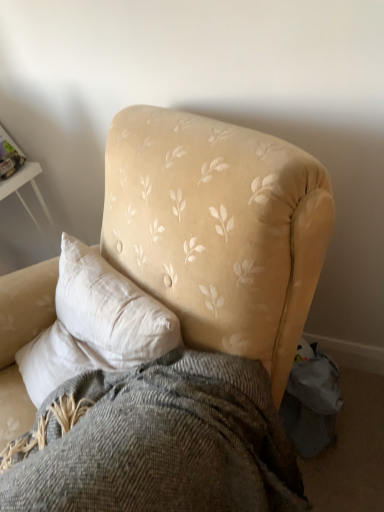
Question: Is textured gray blanket at center inside the boundaries of velvet yellow armchair at center, or outside?

Choices:
 (A) inside
 (B) outside

Answer: (A)

Question: Is textured gray blanket at center to the left or to the right of velvet yellow armchair at center in the image?

Choices:
 (A) right
 (B) left

Answer: (A)

Question: Looking at their shapes, would you say textured gray blanket at center is wider or thinner than velvet yellow armchair at center?

Choices:
 (A) wide
 (B) thin

Answer: (B)

Question: Is velvet yellow armchair at center taller or shorter than textured gray blanket at center?

Choices:
 (A) tall
 (B) short

Answer: (A)

Question: In terms of size, does velvet yellow armchair at center appear bigger or smaller than textured gray blanket at center?

Choices:
 (A) small
 (B) big

Answer: (B)

Question: Considering their positions, is velvet yellow armchair at center located in front of or behind textured gray blanket at center?

Choices:
 (A) behind
 (B) front

Answer: (B)

Question: Does point (299, 219) appear closer or farther from the camera than point (238, 413)?

Choices:
 (A) farther
 (B) closer

Answer: (B)